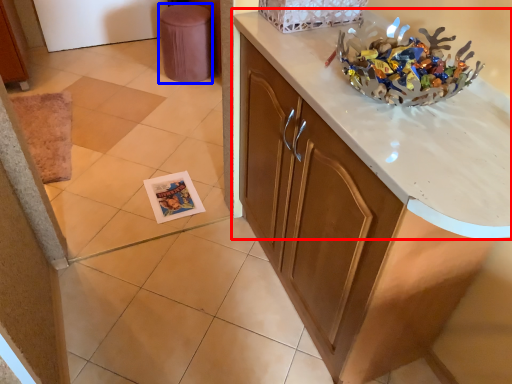
Question: Which object appears closest to the camera in this image, countertop (highlighted by a red box) or stool (highlighted by a blue box)?

Choices:
 (A) countertop
 (B) stool

Answer: (A)